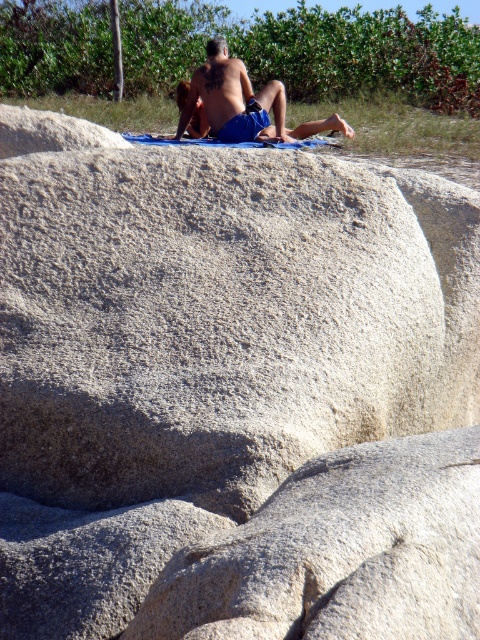
You are planning to place a small potted plant between the gray rough rock at center and the smooth skin tattooed man at upper center. Given their sizes, which object should the plant be closer to?

The gray rough rock at center is thinner than the smooth skin tattooed man at upper center, so the plant should be placed closer to the gray rough rock at center to ensure enough space between them.